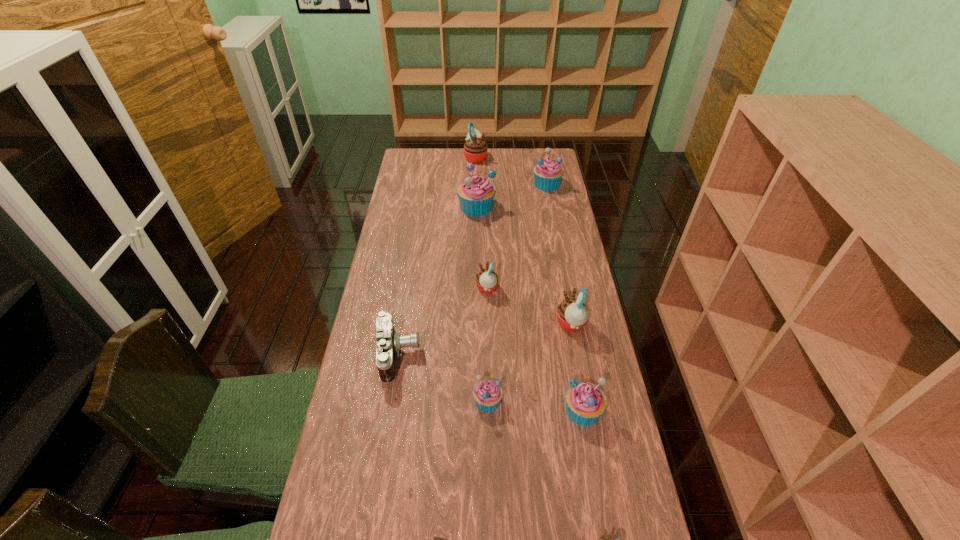
Identify the location of the fourth farthest muffin. The image size is (960, 540). (486, 280).

This screenshot has width=960, height=540. I want to click on the leftmost object, so click(388, 343).

Locate an element on the screen. the smallest blue muffin is located at coordinates (487, 394).

Find the location of `free region located 0.250m on the front-facing side of the farthest pink muffin`. free region located 0.250m on the front-facing side of the farthest pink muffin is located at coordinates (539, 157).

The height and width of the screenshot is (540, 960). In order to click on vacant space located 0.140m on the front of the sixth nearest muffin in this screenshot , I will do `click(476, 240)`.

Where is `free location located on the front of the second farthest object`? The width and height of the screenshot is (960, 540). free location located on the front of the second farthest object is located at coordinates (551, 207).

Locate an element on the screen. vacant space positioned on the front-facing side of the second biggest pink muffin is located at coordinates (525, 324).

Find the location of a particular element. vacant space located on the front-facing side of the second biggest pink muffin is located at coordinates (469, 324).

What are the coordinates of `blank space located on the front-facing side of the second biggest pink muffin` in the screenshot? It's located at (482, 324).

The width and height of the screenshot is (960, 540). In order to click on free space located on the left of the third biggest blue muffin in this screenshot , I will do `click(538, 410)`.